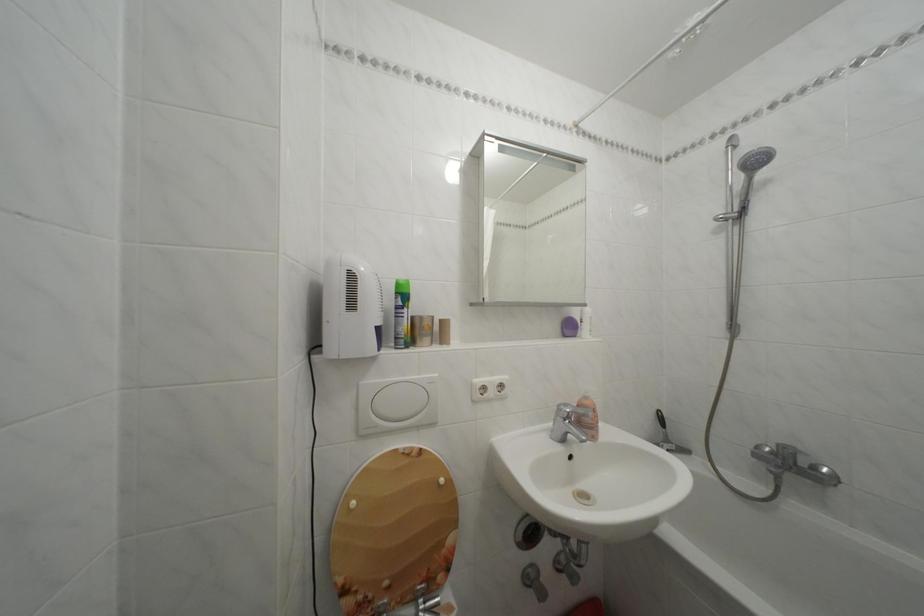
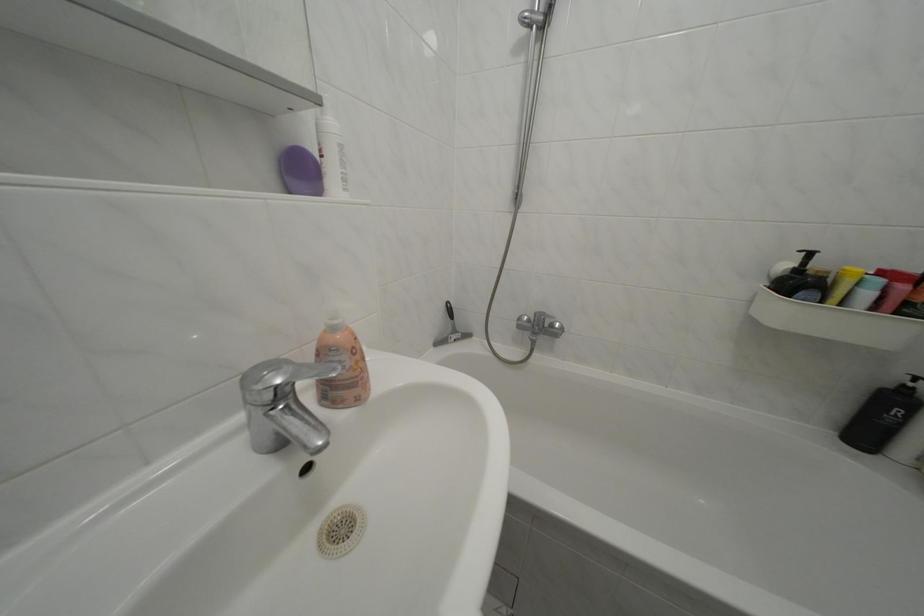
The point at (594, 403) is marked in the first image. Where is the corresponding point in the second image?

(342, 334)